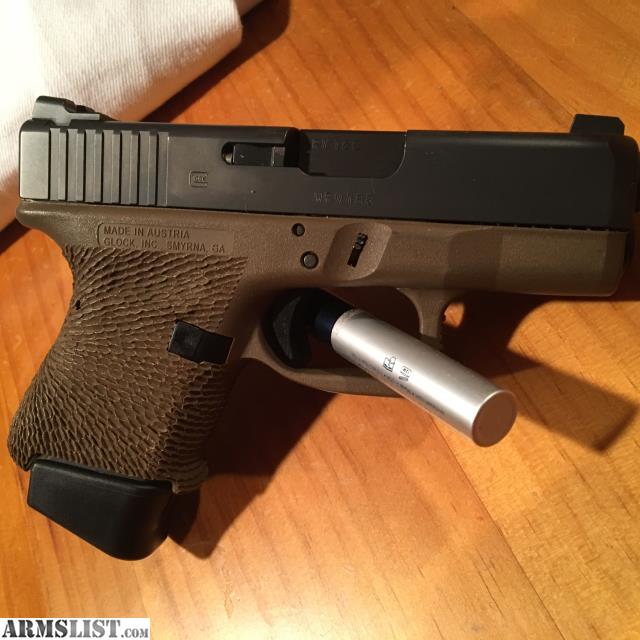
You are a GUI agent. You are given a task and a screenshot of the screen. Output one action in this format:
    pyautogui.click(x=<x>, y=<y>)
    Task: Click on the wooden tabletop
    
    Given the screenshot: What is the action you would take?
    pyautogui.click(x=419, y=516)